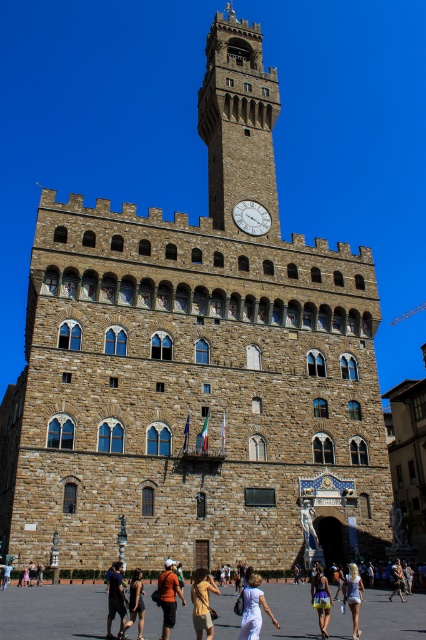
Question: Estimate the real-world distances between objects in this image. Which object is farther from the stone clock tower at center?

Choices:
 (A) white stone clock at center
 (B) orange fabric at center
 (C) light brown leather jacket at center
 (D) yellow and purple skirt at center

Answer: (C)

Question: Does yellow and purple skirt at center have a smaller size compared to matte black shorts at lower center?

Choices:
 (A) no
 (B) yes

Answer: (B)

Question: Which object is farther from the camera taking this photo?

Choices:
 (A) white cotton dress at lower center
 (B) dark blue shirt at center
 (C) light brown leather jacket at center
 (D) smooth stone plaza at lower center

Answer: (C)

Question: Is matte yellow shirt at center above white cotton dress at lower center?

Choices:
 (A) no
 (B) yes

Answer: (B)

Question: Is stone clock tower at center above matte yellow shirt at center?

Choices:
 (A) no
 (B) yes

Answer: (B)

Question: Considering the real-world distances, which object is closest to the white cotton dress at center?

Choices:
 (A) white stone clock at center
 (B) smooth stone plaza at lower center

Answer: (B)